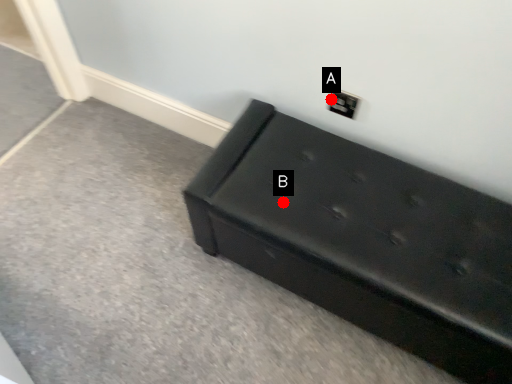
Question: Two points are circled on the image, labeled by A and B beside each circle. Which point is closer to the camera taking this photo?

Choices:
 (A) A is closer
 (B) B is closer

Answer: (B)